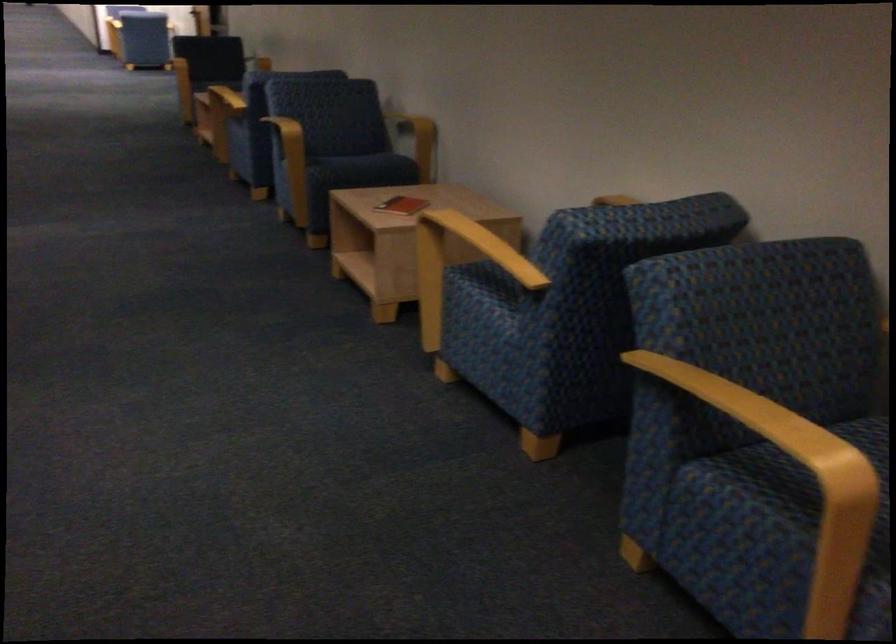
Find the location of `red notebook`. red notebook is located at coordinates (401, 205).